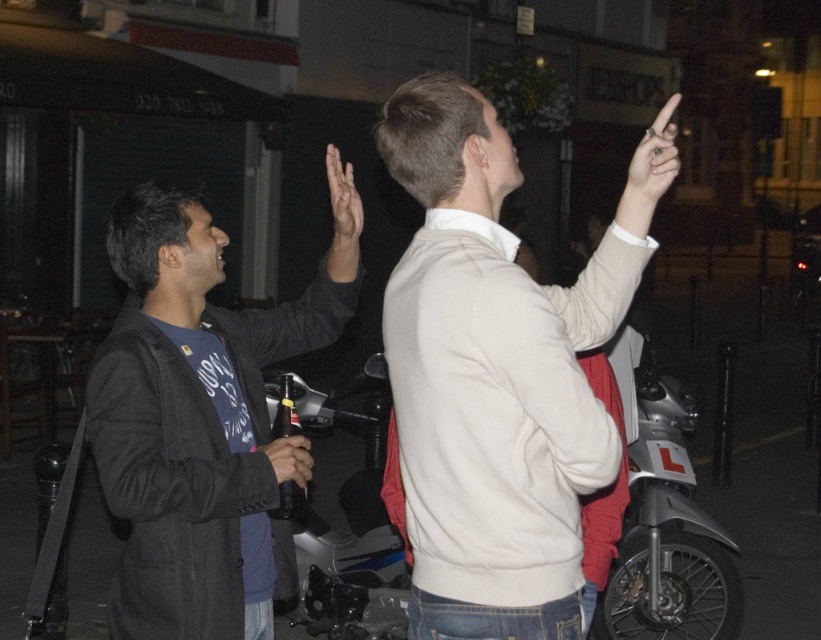
Question: Which point is closer to the camera?

Choices:
 (A) (287, 444)
 (B) (292, 588)

Answer: (A)

Question: Considering the relative positions of dark gray jacket at left and smooth black hand at center in the image provided, where is dark gray jacket at left located with respect to smooth black hand at center?

Choices:
 (A) above
 (B) below

Answer: (A)

Question: Which is farther from the dark gray jacket at left?

Choices:
 (A) smooth black hand at center
 (B) matte skin hand at upper center
 (C) silver metallic motorcycle at center

Answer: (C)

Question: Can you confirm if light beige sweater at upper right is thinner than matte skin hand at upper center?

Choices:
 (A) yes
 (B) no

Answer: (A)

Question: Which point appears farthest from the camera in this image?

Choices:
 (A) (636, 205)
 (B) (306, 456)
 (C) (337, 269)
 (D) (88, 440)

Answer: (D)

Question: Considering the relative positions of matte skin hand at upper center and smooth black hand at center in the image provided, where is matte skin hand at upper center located with respect to smooth black hand at center?

Choices:
 (A) right
 (B) left

Answer: (B)